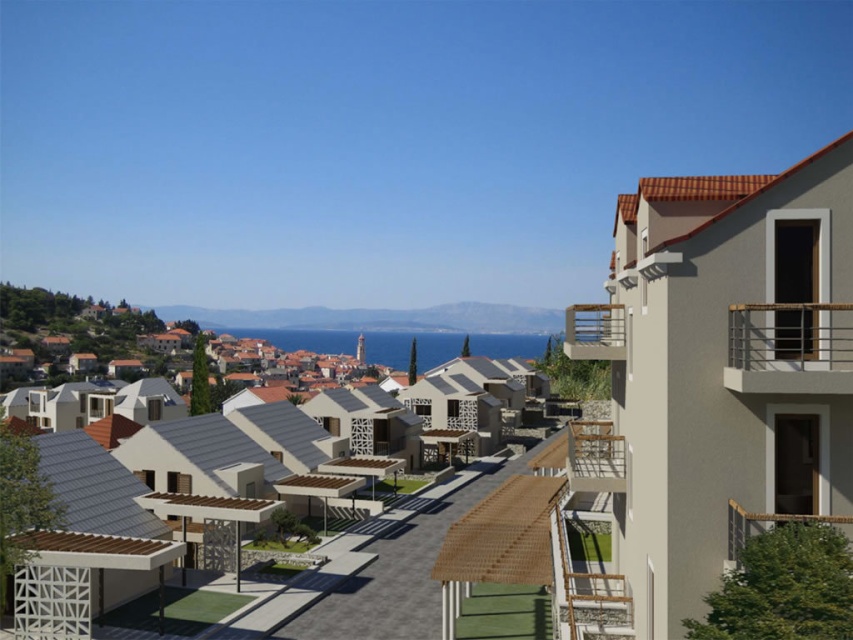
Who is taller, metallic silver railing at upper right or brown wooden balcony at right?

Standing taller between the two is metallic silver railing at upper right.

Between point (776, 372) and point (744, 528), which one is positioned in front?

Point (776, 372)

Describe the element at coordinates (788, 348) in the screenshot. I see `metallic silver railing at upper right` at that location.

Identify the location of metallic silver railing at upper right. The image size is (853, 640). (788, 348).

Between metallic silver railing at upper right and brown wooden balcony at upper right, which one appears on the right side from the viewer's perspective?

brown wooden balcony at upper right is more to the right.

Does metallic silver railing at upper right have a lesser height compared to brown wooden balcony at upper right?

Yes, metallic silver railing at upper right is shorter than brown wooden balcony at upper right.

Is point (746, 365) positioned after point (596, 336)?

No, it is in front of (596, 336).

Find the location of a particular element. metallic silver railing at upper right is located at coordinates (788, 348).

Is brown wooden balcony at upper right wider than brown wooden balcony at right?

Yes, brown wooden balcony at upper right is wider than brown wooden balcony at right.

Can you confirm if brown wooden balcony at upper right is shorter than brown wooden balcony at right?

In fact, brown wooden balcony at upper right may be taller than brown wooden balcony at right.

Identify the location of brown wooden balcony at upper right. This screenshot has width=853, height=640. (595, 332).